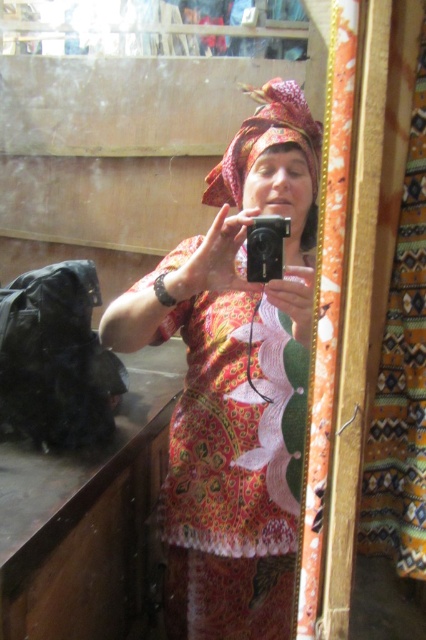
Question: Is printed fabric dress at center behind printed fabric shawl at center?

Choices:
 (A) yes
 (B) no

Answer: (B)

Question: Does printed fabric dress at center appear on the right side of printed fabric shawl at center?

Choices:
 (A) yes
 (B) no

Answer: (B)

Question: Among these points, which one is farthest from the camera?

Choices:
 (A) (264, 573)
 (B) (250, 118)

Answer: (B)

Question: Does printed fabric dress at center have a smaller size compared to printed fabric shawl at center?

Choices:
 (A) yes
 (B) no

Answer: (B)

Question: Which point appears closest to the camera in this image?

Choices:
 (A) [x=245, y=544]
 (B) [x=311, y=132]

Answer: (A)